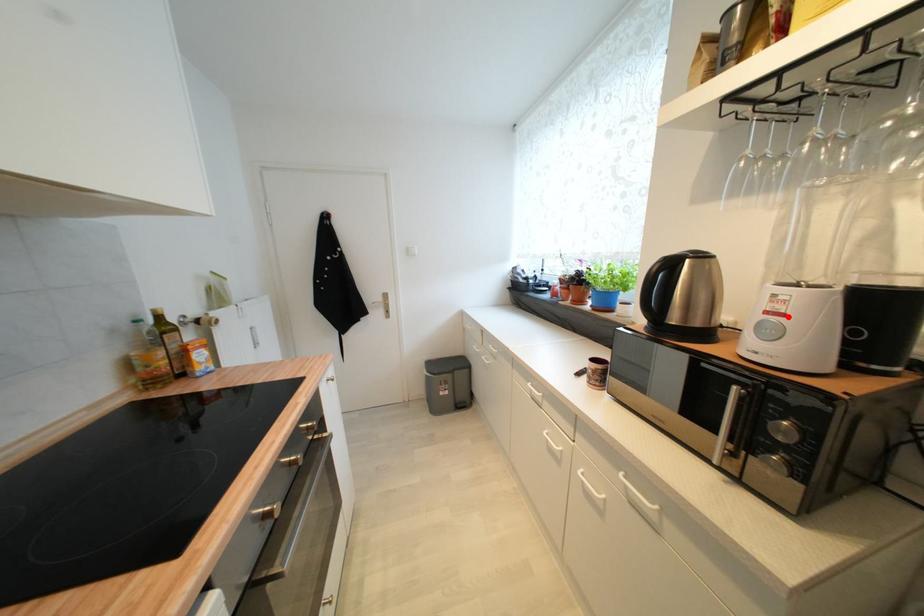
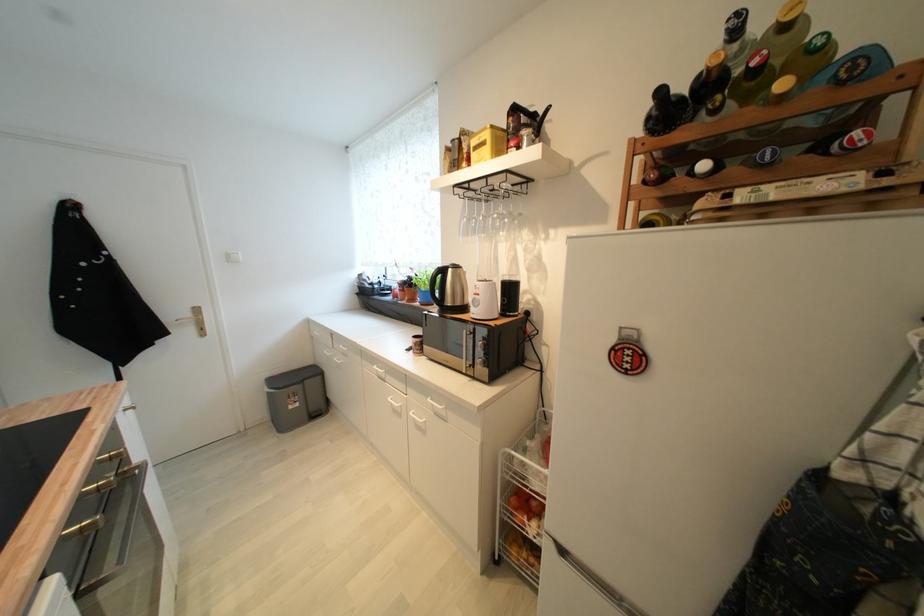
Locate, in the second image, the point that corresponds to the highlighted location in the first image.

(483, 296)